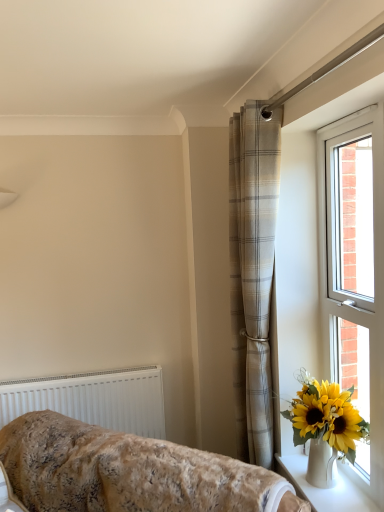
Locate an element on the screen. The width and height of the screenshot is (384, 512). empty space that is ontop of white ceramic vase at lower right is located at coordinates (336, 488).